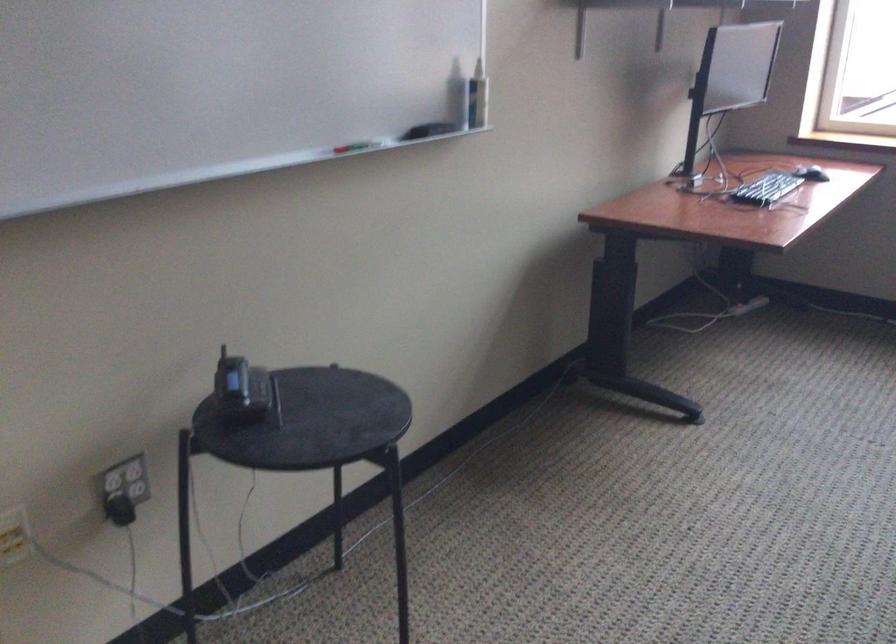
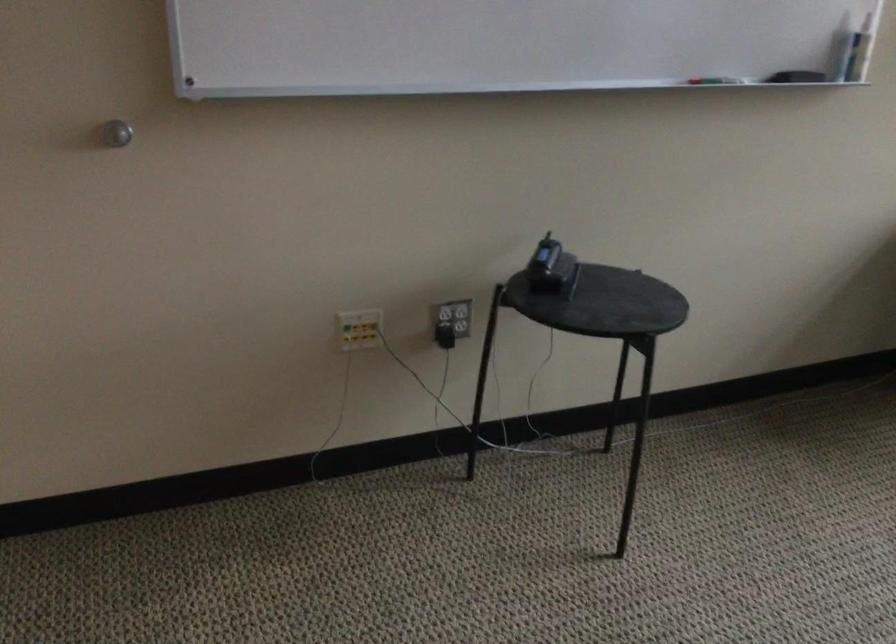
Find the pixel in the second image that matches [122,509] in the first image.

(444, 336)